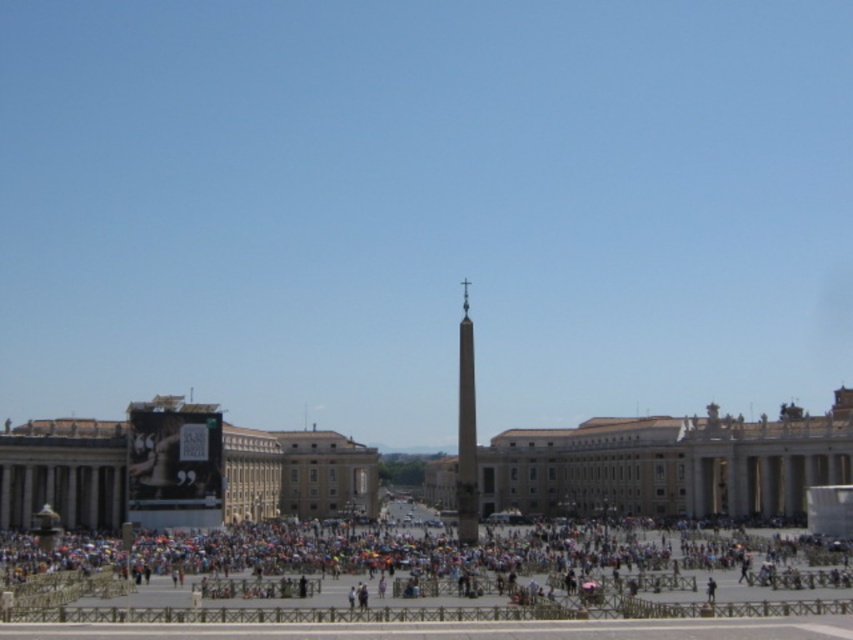
Question: Is multicolored fabric crowd at lower center to the left of polished stone obelisk at center from the viewer's perspective?

Choices:
 (A) no
 (B) yes

Answer: (B)

Question: Does multicolored fabric crowd at lower center have a lesser width compared to polished stone obelisk at center?

Choices:
 (A) no
 (B) yes

Answer: (A)

Question: Which of the following is the closest to the observer?

Choices:
 (A) (555, 576)
 (B) (473, 352)

Answer: (A)

Question: Among these points, which one is nearest to the camera?

Choices:
 (A) (469, 452)
 (B) (119, 554)

Answer: (B)

Question: Which of the following is the farthest from the observer?

Choices:
 (A) multicolored fabric crowd at lower center
 (B) polished stone obelisk at center

Answer: (B)

Question: Does multicolored fabric crowd at lower center have a smaller size compared to polished stone obelisk at center?

Choices:
 (A) no
 (B) yes

Answer: (A)